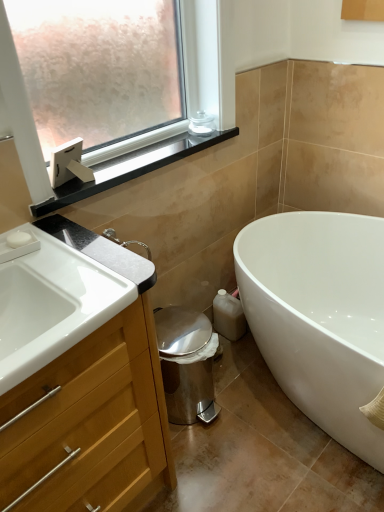
The width and height of the screenshot is (384, 512). Identify the location of free space to the left of clear glass jar at upper center. point(167,145).